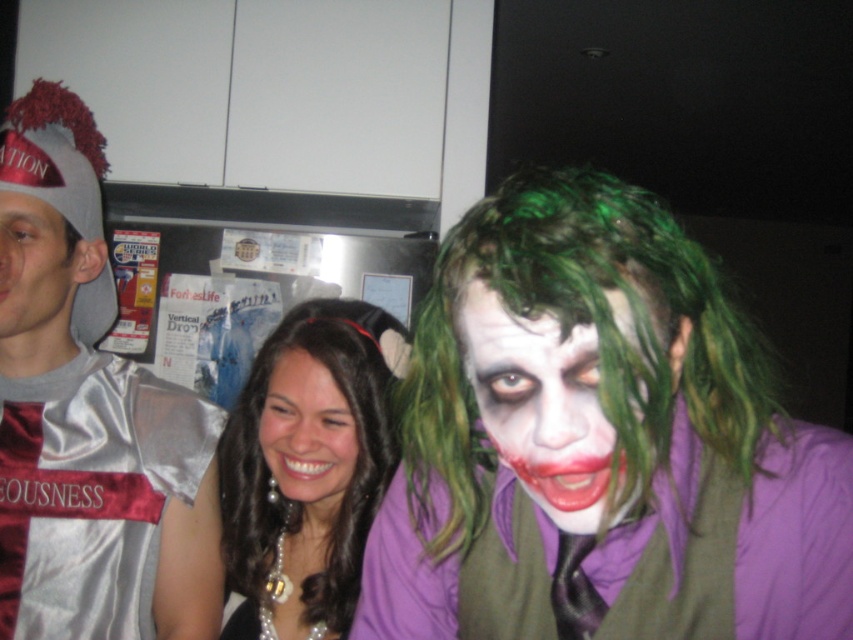
You are a photographer setting up for a group photo. You have a camera with a 2.5 inch wide lens. You need to capture both the green synthetic wig at right and the green matte wig at center in the same frame. Can the lens fit both wigs if they are 1.93 inches apart?

The distance between the green synthetic wig at right and the green matte wig at center is 1.93 inches. Since the lens is 2.5 inches wide, which is wider than the distance between them, the lens can fit both wigs in the frame.

You are organizing a costume party and need to decide which item takes up more space horizontally. Based on the scene, which object is wider between the silver satin jersey at left and the green matte wig at upper right?

The green matte wig at upper right is wider than the silver satin jersey at left.

You are a photographer trying to capture a group photo. The black pearl necklace at center and the matte gray face at left are in your frame. Based on their widths, which one appears wider in the photo?

The black pearl necklace at center appears wider in the photo because its width surpasses that of the matte gray face at left.